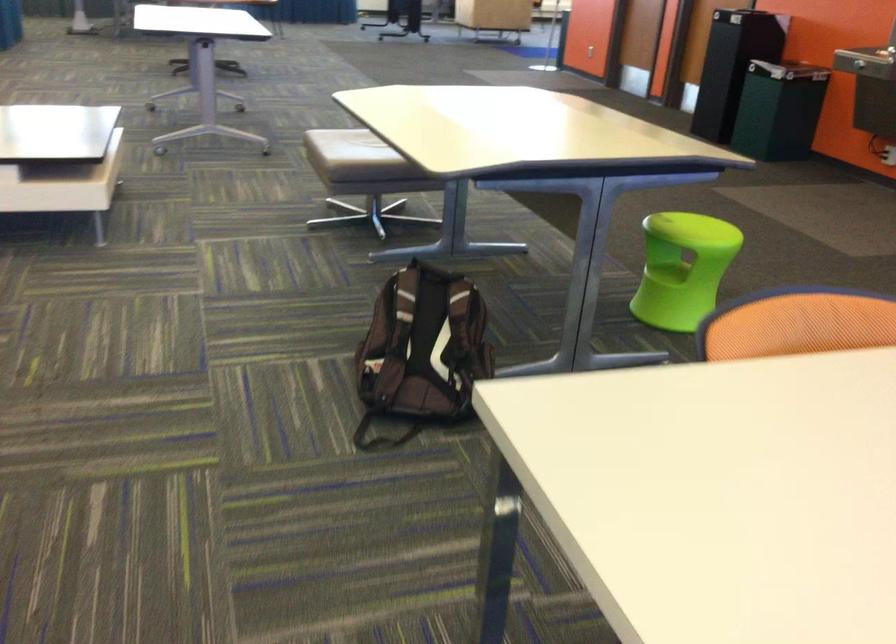
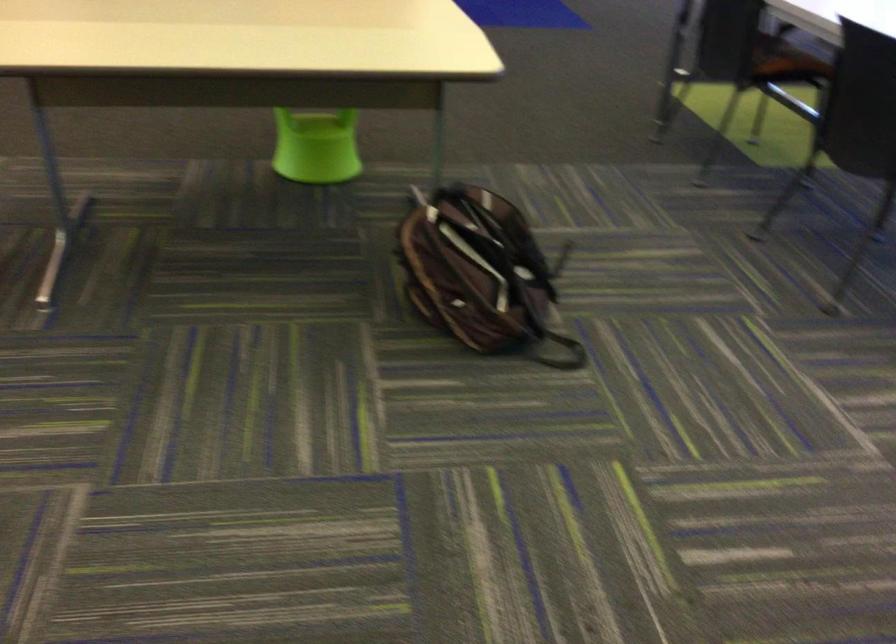
The point at (403, 134) is marked in the first image. Where is the corresponding point in the second image?

(322, 67)